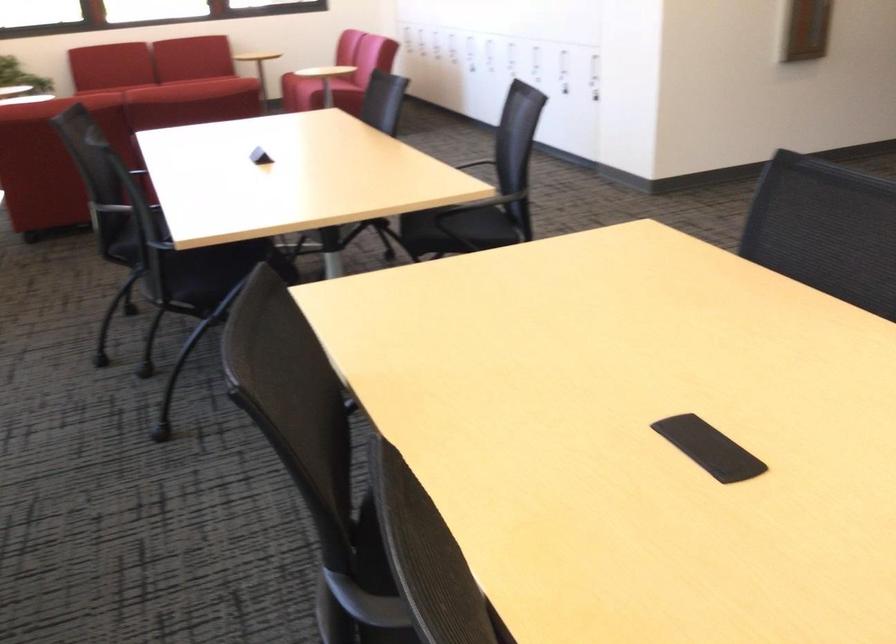
Find the location of `white locker handle`. white locker handle is located at coordinates (489, 202).